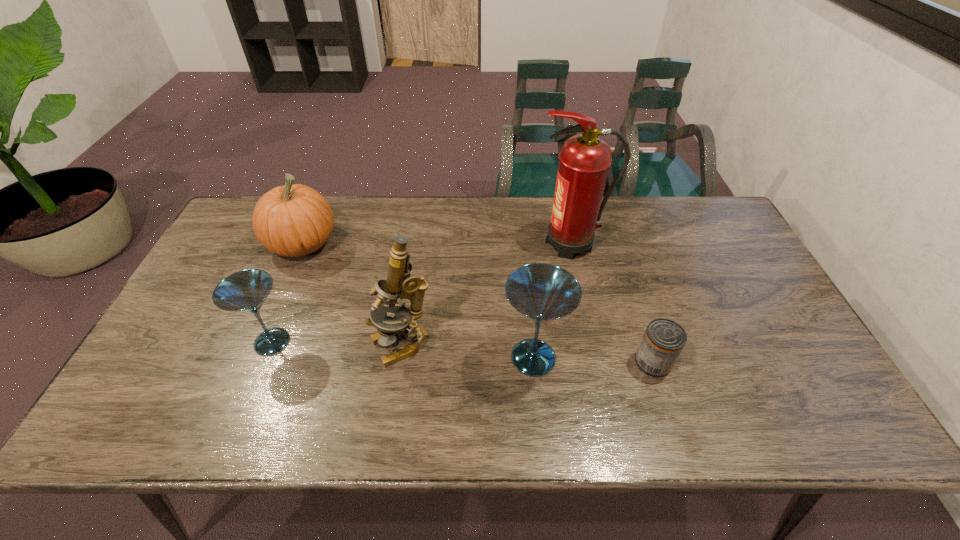
The image size is (960, 540). Identify the location of the left martini. (245, 291).

What are the coordinates of `the shorter martini` in the screenshot? It's located at (245, 291).

This screenshot has height=540, width=960. Find the location of `the right martini`. the right martini is located at coordinates (543, 292).

Locate an element on the screen. pumpkin is located at coordinates (295, 220).

Where is `the tallest object`? The image size is (960, 540). the tallest object is located at coordinates (584, 160).

Identify the location of the second tallest object. The width and height of the screenshot is (960, 540). (399, 284).

Find the location of a particular element. This screenshot has height=540, width=960. the fourth object from right to left is located at coordinates [399, 284].

Where is `the shortest object`? The image size is (960, 540). the shortest object is located at coordinates (664, 339).

Where is `vacant space located 0.100m on the back of the left martini`? vacant space located 0.100m on the back of the left martini is located at coordinates (291, 294).

Identify the location of vacant space located on the back of the right martini. The width and height of the screenshot is (960, 540). coord(526,289).